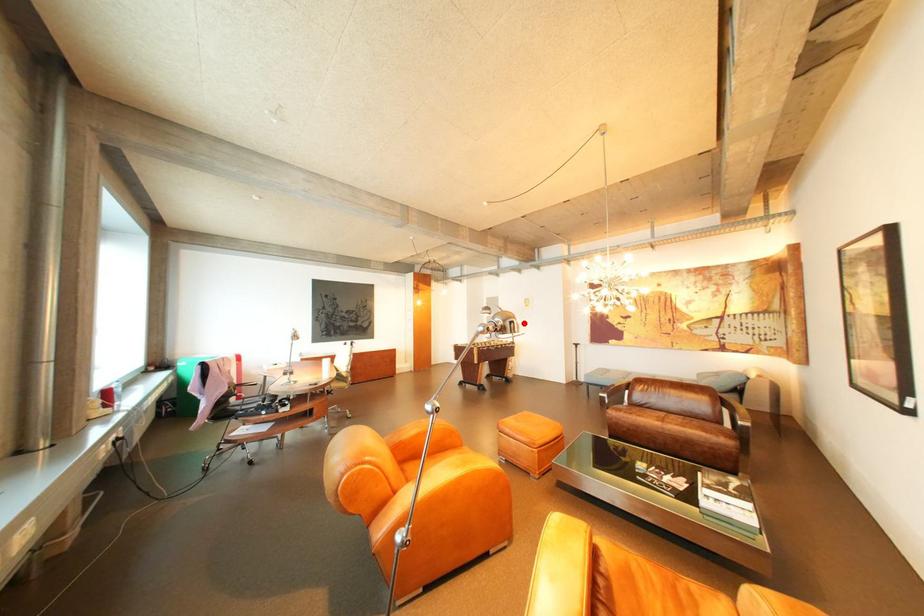
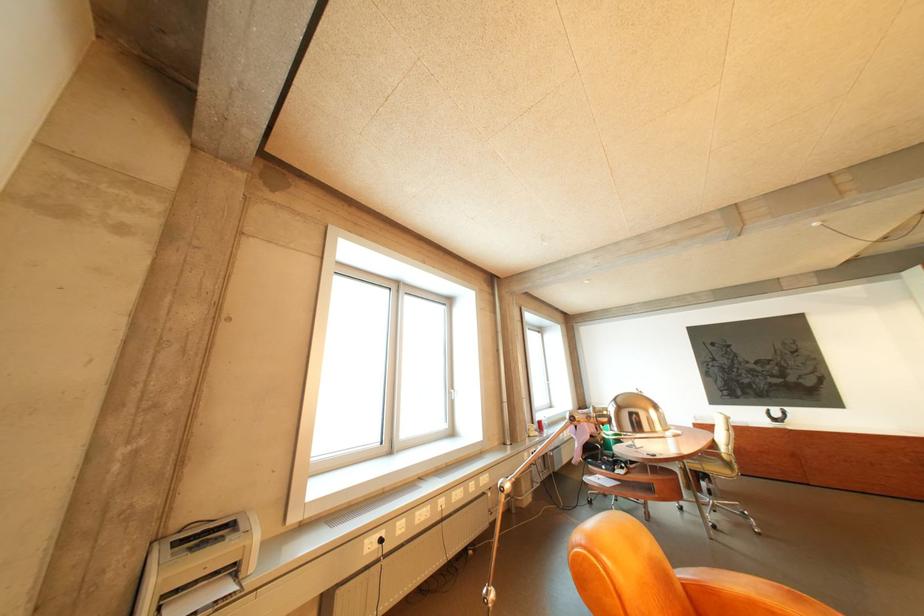
In the second image, find the point that corresponds to the highlighted location in the first image.

(643, 415)